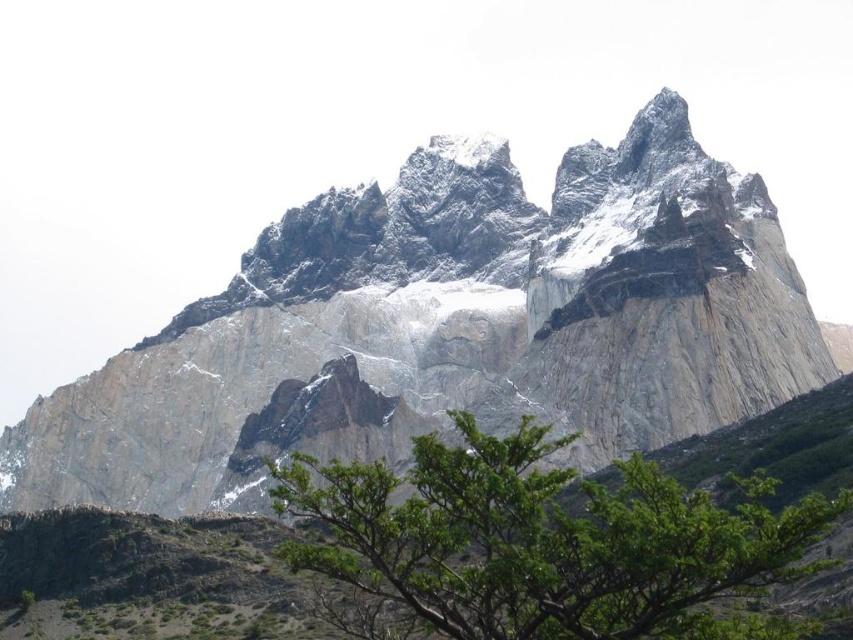
You are a hiker standing at the base of the rugged stone mountain range at upper center and the green leafy tree at center. Which object is higher in elevation?

The rugged stone mountain range at upper center is higher in elevation than the green leafy tree at center because it is positioned above it in the image.

You are a photographer planning to capture a landscape photo of the rugged stone mountain range at upper center and the green leafy tree at center. Since you want both subjects to be clearly visible, which object should you focus on first to ensure proper depth of field?

The rugged stone mountain range at upper center should be focused on first because its width is larger than the green leafy tree at center, allowing for better depth of field coverage.